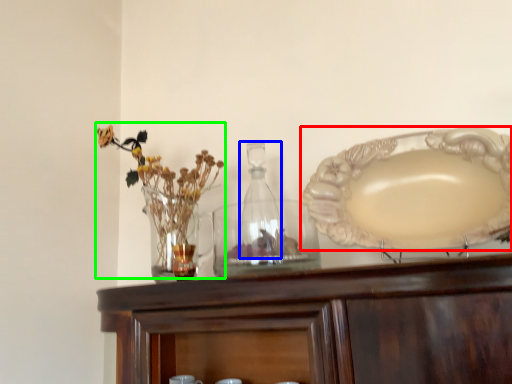
Question: Estimate the real-world distances between objects in this image. Which object is closer to plate (highlighted by a red box), bottle (highlighted by a blue box) or floral arrangement (highlighted by a green box)?

Choices:
 (A) bottle
 (B) floral arrangement

Answer: (A)